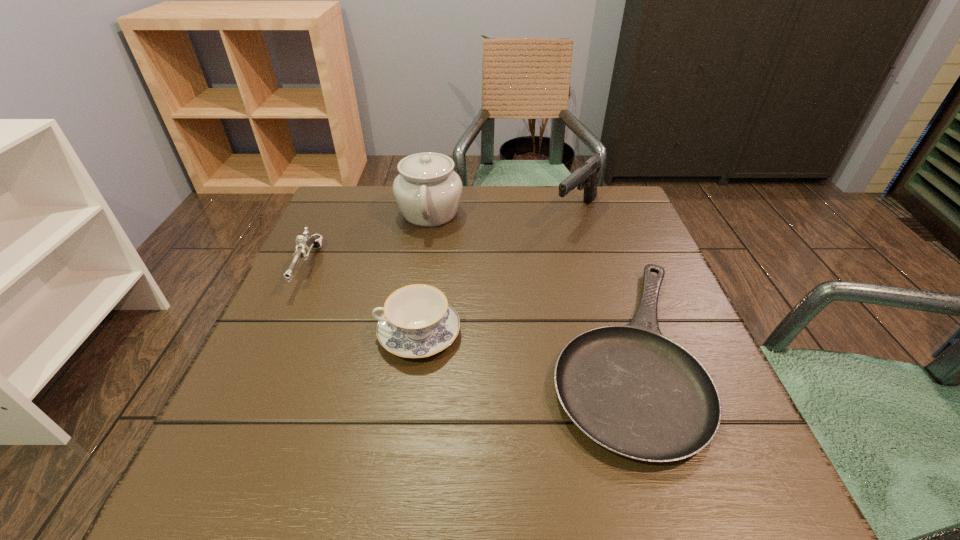
This screenshot has width=960, height=540. What are the coordinates of `vacant space located 0.110m with the handle on the side of the nearer chinaware` in the screenshot? It's located at (320, 334).

I want to click on vacant space located with the handle on the side of the nearer chinaware, so click(x=330, y=334).

You are a GUI agent. You are given a task and a screenshot of the screen. Output one action in this format:
    pyautogui.click(x=<x>, y=<y>)
    Task: Click on the vacant space located with the handle on the side of the nearer chinaware
    The image size is (960, 540).
    Given the screenshot: What is the action you would take?
    pyautogui.click(x=314, y=334)

You are a GUI agent. You are given a task and a screenshot of the screen. Output one action in this format:
    pyautogui.click(x=<x>, y=<y>)
    Task: Click on the vacant area located on the left of the shortest object
    
    Given the screenshot: What is the action you would take?
    pyautogui.click(x=489, y=351)

Find the location of a particular element. The width and height of the screenshot is (960, 540). chinaware that is at the far edge is located at coordinates (428, 191).

Locate an element on the screen. The image size is (960, 540). gun positioned at the far edge is located at coordinates (586, 175).

Image resolution: width=960 pixels, height=540 pixels. I want to click on object present at the near edge, so click(630, 389).

You are a GUI agent. You are given a task and a screenshot of the screen. Output one action in this format:
    pyautogui.click(x=<x>, y=<y>)
    Task: Click on the object at the left edge
    The width and height of the screenshot is (960, 540).
    Given the screenshot: What is the action you would take?
    pyautogui.click(x=304, y=245)

You are a GUI agent. You are given a task and a screenshot of the screen. Output one action in this format:
    pyautogui.click(x=<x>, y=<y>)
    Task: Click on the gun at the right edge
    Image resolution: width=960 pixels, height=540 pixels.
    Given the screenshot: What is the action you would take?
    pyautogui.click(x=586, y=175)

The image size is (960, 540). I want to click on frying pan located at the right edge, so pyautogui.click(x=630, y=389).